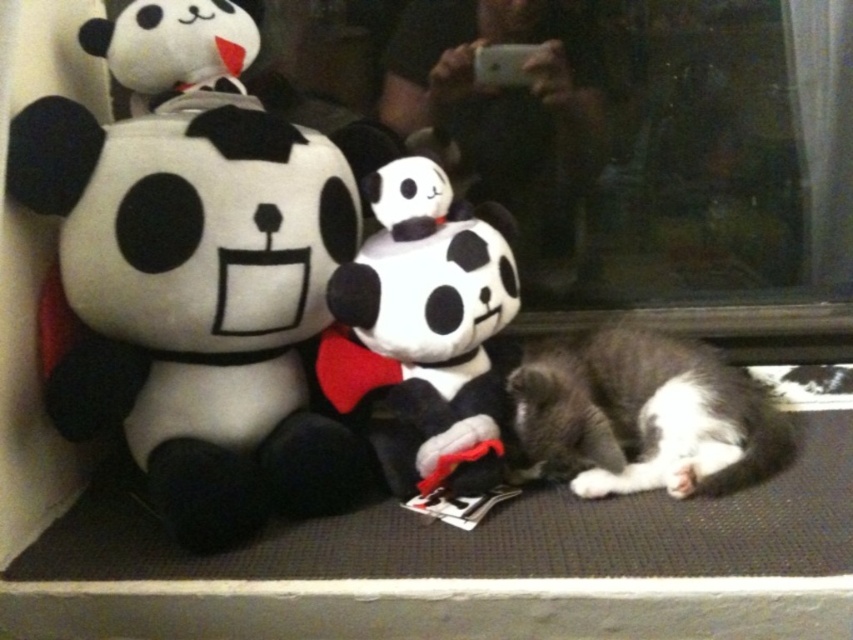
Is soft plush panda at left to the right of soft plush toy at center from the viewer's perspective?

Incorrect, soft plush panda at left is not on the right side of soft plush toy at center.

Which is behind, point (106, 348) or point (569, 202)?

The point (569, 202) is behind.

The height and width of the screenshot is (640, 853). I want to click on soft plush panda at left, so click(x=196, y=301).

At what (x,y) coordinates should I click in order to perform the action: click on soft plush panda at left. Please return your answer as a coordinate pair (x, y). The height and width of the screenshot is (640, 853). Looking at the image, I should click on (196, 301).

Who is higher up, soft plush toy at center or white plush toy at upper left?

white plush toy at upper left

Is soft plush toy at center above white plush toy at upper left?

Incorrect, soft plush toy at center is not positioned above white plush toy at upper left.

Does point (415, 52) come in front of point (187, 1)?

No, it is not.

Where is `soft plush toy at center`? The height and width of the screenshot is (640, 853). soft plush toy at center is located at coordinates (506, 115).

Does soft plush panda at center appear under gray-furred cat at lower right?

No, soft plush panda at center is not below gray-furred cat at lower right.

Is soft plush panda at center behind gray-furred cat at lower right?

No.

This screenshot has width=853, height=640. In order to click on soft plush panda at center in this screenshot , I will do `click(421, 321)`.

You are a GUI agent. You are given a task and a screenshot of the screen. Output one action in this format:
    pyautogui.click(x=<x>, y=<y>)
    Task: Click on the soft plush panda at center
    The height and width of the screenshot is (640, 853).
    Given the screenshot: What is the action you would take?
    pyautogui.click(x=421, y=321)